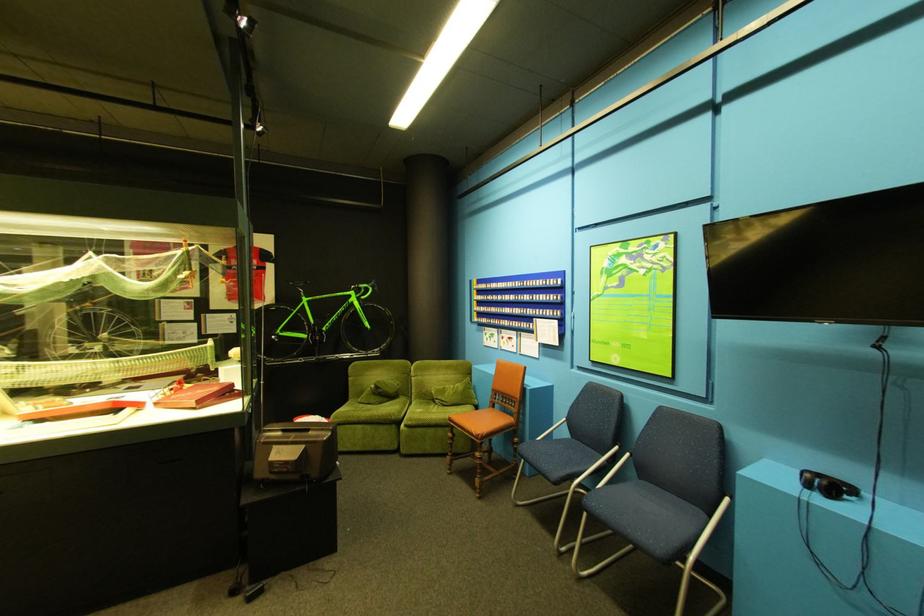
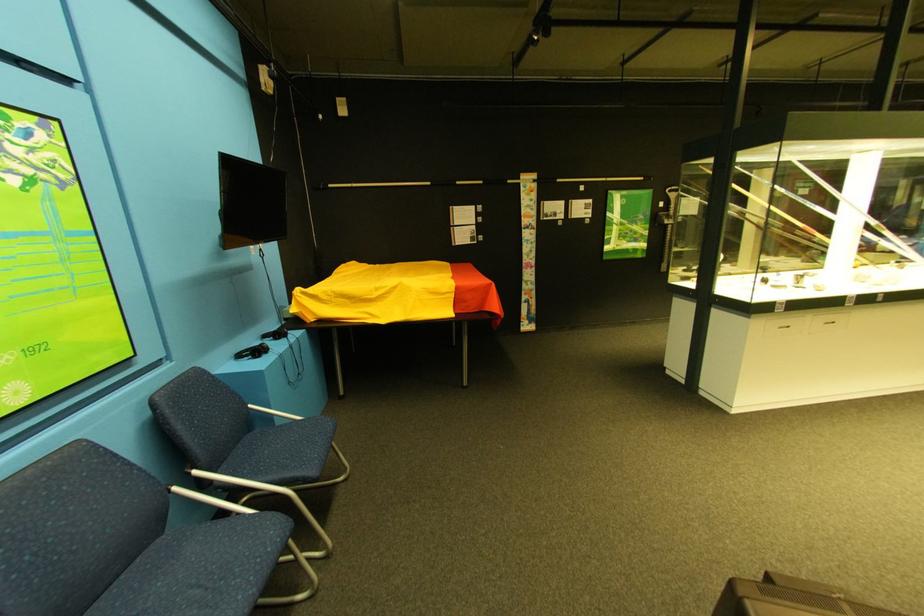
The point at (643, 456) is marked in the first image. Where is the corresponding point in the second image?

(210, 474)